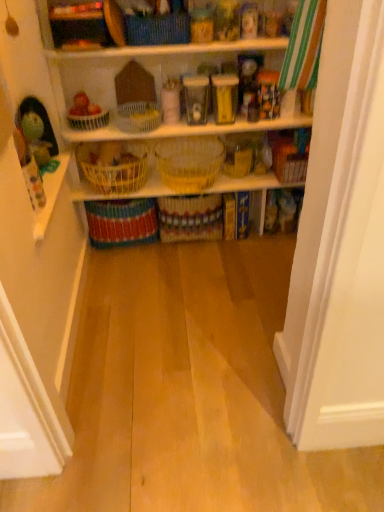
Question: Looking at their shapes, would you say yellow wicker basket at center, which is the 5th basket from top to bottom, is wider or thinner than multicolored woven basket at center, the seventh basket when ordered from top to bottom?

Choices:
 (A) wide
 (B) thin

Answer: (A)

Question: From the image's perspective, is yellow wicker basket at center, the third basket in the bottom-to-top sequence, located above or below multicolored woven basket at center, which is the first basket in bottom-to-top order?

Choices:
 (A) below
 (B) above

Answer: (B)

Question: Which object is positioned closest to the multicolored woven basket at center, the seventh basket when ordered from top to bottom?

Choices:
 (A) yellow wicker basket at center, the third basket in the bottom-to-top sequence
 (B) woven fabric basket at upper center, placed as the first basket when sorted from top to bottom
 (C) yellow wicker baskets at center
 (D) white wicker basket at center, the third basket when ordered from top to bottom
 (E) green plush toy at left

Answer: (A)

Question: Considering the real-world distances, which object is closest to the green plush toy at left?

Choices:
 (A) woven fabric basket at upper center, placed as the first basket when sorted from top to bottom
 (B) woven yellow basket at center, marked as the fourth basket in a top-to-bottom arrangement
 (C) yellow woven basket at center, which appears as the second basket when ordered from the bottom
 (D) yellow wicker basket at center, which is the 5th basket from top to bottom
 (E) multicolored woven basket at center, which is the first basket in bottom-to-top order

Answer: (D)